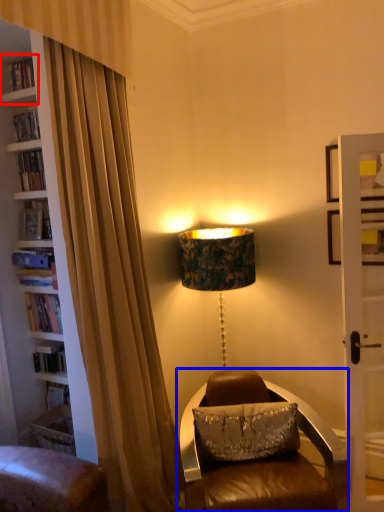
Question: Which object is further to the camera taking this photo, shelf (highlighted by a red box) or chair (highlighted by a blue box)?

Choices:
 (A) shelf
 (B) chair

Answer: (A)